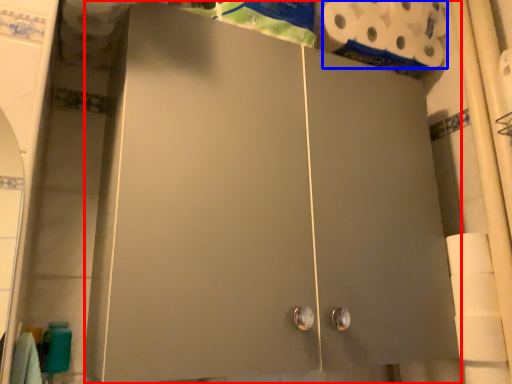
Question: Which object is closer to the camera taking this photo, cupboard (highlighted by a red box) or toilet paper (highlighted by a blue box)?

Choices:
 (A) cupboard
 (B) toilet paper

Answer: (A)